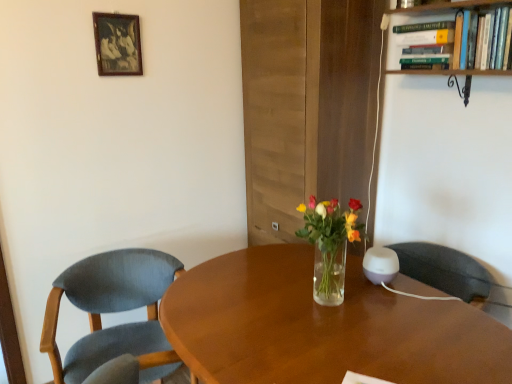
Question: Is green hardcover book at upper right completely or partially outside of wooden bookshelf at upper right?

Choices:
 (A) no
 (B) yes

Answer: (A)

Question: From a real-world perspective, is green hardcover book at upper right under wooden bookshelf at upper right?

Choices:
 (A) no
 (B) yes

Answer: (A)

Question: From the image's perspective, is green hardcover book at upper right located above wooden bookshelf at upper right?

Choices:
 (A) no
 (B) yes

Answer: (B)

Question: Does green hardcover book at upper right have a greater height compared to wooden bookshelf at upper right?

Choices:
 (A) yes
 (B) no

Answer: (B)

Question: From a real-world perspective, is green hardcover book at upper right located higher than wooden bookshelf at upper right?

Choices:
 (A) no
 (B) yes

Answer: (B)

Question: From a real-world perspective, is wooden bookshelf at upper right positioned above or below wooden picture frame at upper left?

Choices:
 (A) below
 (B) above

Answer: (A)

Question: From the image's perspective, is wooden bookshelf at upper right positioned above or below wooden picture frame at upper left?

Choices:
 (A) above
 (B) below

Answer: (B)

Question: Is wooden bookshelf at upper right wider or thinner than wooden picture frame at upper left?

Choices:
 (A) wide
 (B) thin

Answer: (A)

Question: Considering the positions of point (467, 74) and point (98, 64), is point (467, 74) closer or farther from the camera than point (98, 64)?

Choices:
 (A) closer
 (B) farther

Answer: (A)

Question: Is textured blue fabric chair at left bigger or smaller than wooden desk at center?

Choices:
 (A) big
 (B) small

Answer: (A)

Question: Considering the positions of point (104, 281) and point (218, 324), is point (104, 281) closer or farther from the camera than point (218, 324)?

Choices:
 (A) farther
 (B) closer

Answer: (A)

Question: Considering the positions of textured blue fabric chair at left and wooden desk at center in the image, is textured blue fabric chair at left taller or shorter than wooden desk at center?

Choices:
 (A) tall
 (B) short

Answer: (A)

Question: Would you say textured blue fabric chair at left is inside or outside wooden desk at center?

Choices:
 (A) inside
 (B) outside

Answer: (B)

Question: From the image's perspective, is textured blue fabric chair at left positioned above or below wooden picture frame at upper left?

Choices:
 (A) below
 (B) above

Answer: (A)

Question: Considering the positions of textured blue fabric chair at left and wooden picture frame at upper left in the image, is textured blue fabric chair at left bigger or smaller than wooden picture frame at upper left?

Choices:
 (A) small
 (B) big

Answer: (B)